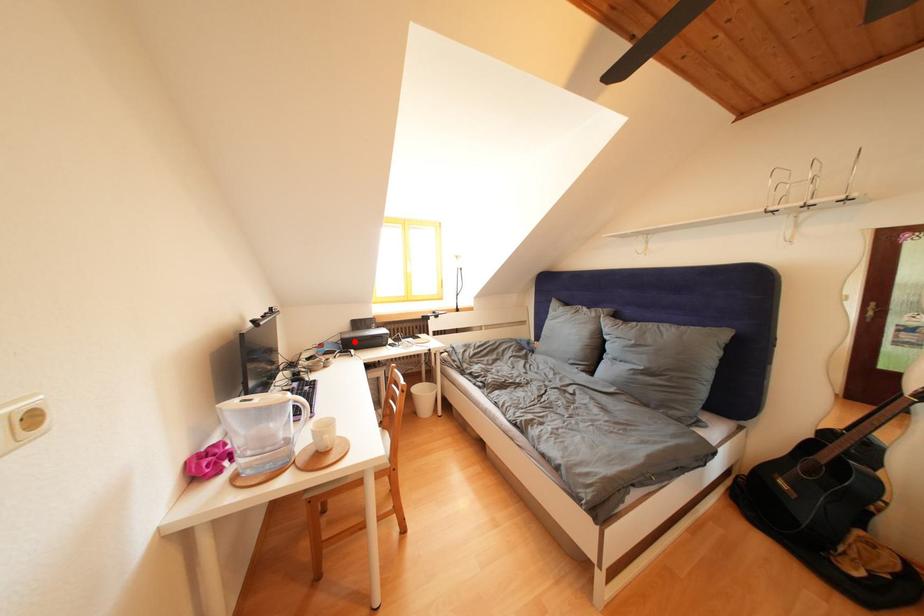
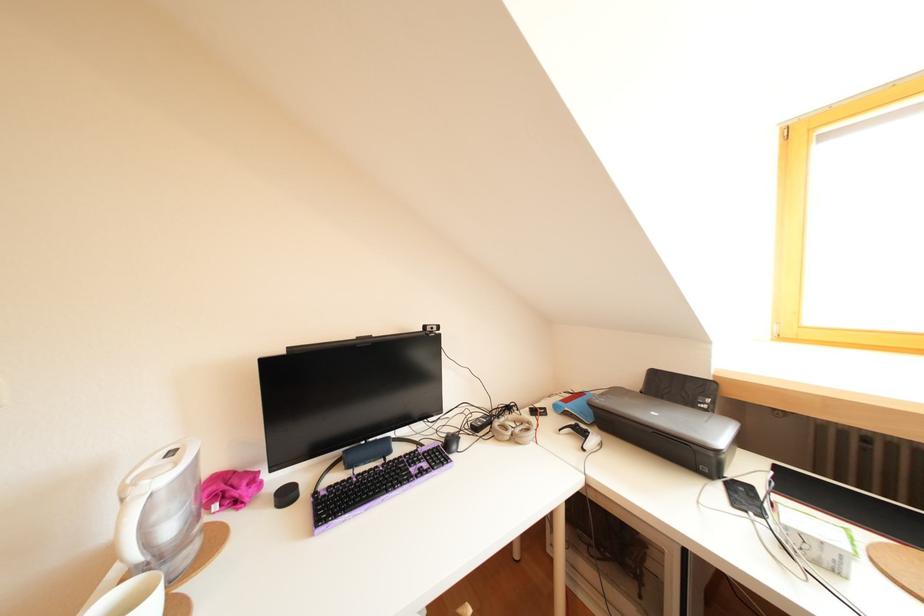
The point at the highlighted location is marked in the first image. Where is the corresponding point in the second image?

(610, 407)